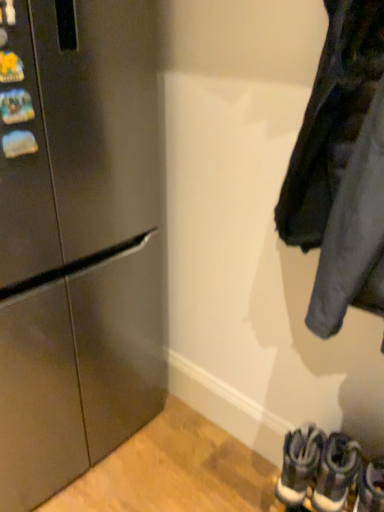
What is the approximate width of dark gray fabric jacket at right?

16.09 inches.

Identify the location of white leather sneakers at lower right, the first footwear in the right-to-left sequence. The image size is (384, 512). (371, 487).

From a real-world perspective, is dark gray suede sneakers at lower right, which is counted as the second footwear, starting from the left, physically located above or below dark gray fabric jacket at right?

Clearly, from a real-world perspective, dark gray suede sneakers at lower right, which is counted as the second footwear, starting from the left, is below dark gray fabric jacket at right.

Is dark gray suede sneakers at lower right, which is counted as the second footwear, starting from the left, outside of dark gray fabric jacket at right?

That's correct, dark gray suede sneakers at lower right, which is counted as the second footwear, starting from the left, is outside of dark gray fabric jacket at right.

Considering the points (319, 470) and (329, 105), which point is behind, point (319, 470) or point (329, 105)?

The point (319, 470) is farther.

Is dark gray fabric jacket at right far away from white leather sneakers at lower right, the first footwear positioned from the left?

No, dark gray fabric jacket at right is not far away from white leather sneakers at lower right, the first footwear positioned from the left.

Measure the distance between dark gray fabric jacket at right and white leather sneakers at lower right, positioned as the 3th footwear in right-to-left order.

dark gray fabric jacket at right is 26.94 inches away from white leather sneakers at lower right, positioned as the 3th footwear in right-to-left order.

What's the angular difference between dark gray fabric jacket at right and white leather sneakers at lower right, positioned as the 3th footwear in right-to-left order,'s facing directions?

7.63 degrees.

Between dark gray fabric jacket at right and white leather sneakers at lower right, positioned as the 3th footwear in right-to-left order, which one appears on the right side from the viewer's perspective?

Positioned to the right is dark gray fabric jacket at right.

Considering the positions of objects stainless steel refrigerator at left and white leather sneakers at lower right, the first footwear positioned from the left, in the image provided, who is more to the left, stainless steel refrigerator at left or white leather sneakers at lower right, the first footwear positioned from the left,?

stainless steel refrigerator at left is more to the left.

Is stainless steel refrigerator at left facing towards white leather sneakers at lower right, the first footwear positioned from the left?

Yes, stainless steel refrigerator at left faces towards white leather sneakers at lower right, the first footwear positioned from the left.

Can you confirm if stainless steel refrigerator at left is shorter than white leather sneakers at lower right, the first footwear positioned from the left?

No.

Is stainless steel refrigerator at left positioned beyond the bounds of white leather sneakers at lower right, positioned as the 3th footwear in right-to-left order?

Yes, stainless steel refrigerator at left is located beyond the bounds of white leather sneakers at lower right, positioned as the 3th footwear in right-to-left order.

Which object is positioned more to the left, white leather sneakers at lower right, the first footwear positioned from the left, or stainless steel refrigerator at left?

Positioned to the left is stainless steel refrigerator at left.

Is white leather sneakers at lower right, positioned as the 3th footwear in right-to-left order, smaller than stainless steel refrigerator at left?

Yes, white leather sneakers at lower right, positioned as the 3th footwear in right-to-left order, is smaller than stainless steel refrigerator at left.

Do you think white leather sneakers at lower right, positioned as the 3th footwear in right-to-left order, is within stainless steel refrigerator at left, or outside of it?

white leather sneakers at lower right, positioned as the 3th footwear in right-to-left order, is not enclosed by stainless steel refrigerator at left.

Measure the distance from white leather sneakers at lower right, the first footwear positioned from the left, to stainless steel refrigerator at left.

white leather sneakers at lower right, the first footwear positioned from the left, and stainless steel refrigerator at left are 83.42 centimeters apart.

How different are the orientations of dark gray suede sneakers at lower right, which is counted as the second footwear, starting from the left, and stainless steel refrigerator at left in degrees?

The angle between the facing direction of dark gray suede sneakers at lower right, which is counted as the second footwear, starting from the left, and the facing direction of stainless steel refrigerator at left is 81.1 degrees.

Considering the sizes of dark gray suede sneakers at lower right, which is counted as the second footwear, starting from the left, and stainless steel refrigerator at left in the image, is dark gray suede sneakers at lower right, which is counted as the second footwear, starting from the left, wider or thinner than stainless steel refrigerator at left?

Clearly, dark gray suede sneakers at lower right, which is counted as the second footwear, starting from the left, has less width compared to stainless steel refrigerator at left.

Do you think dark gray suede sneakers at lower right, the 2th footwear from the right, is within stainless steel refrigerator at left, or outside of it?

dark gray suede sneakers at lower right, the 2th footwear from the right, is not inside stainless steel refrigerator at left, it's outside.

From a real-world perspective, who is located higher, dark gray suede sneakers at lower right, which is counted as the second footwear, starting from the left, or stainless steel refrigerator at left?

stainless steel refrigerator at left is physically above.

Considering the relative sizes of dark gray suede sneakers at lower right, which is counted as the second footwear, starting from the left, and white leather sneakers at lower right, arranged as the 3th footwear when viewed from the left, in the image provided, is dark gray suede sneakers at lower right, which is counted as the second footwear, starting from the left, wider than white leather sneakers at lower right, arranged as the 3th footwear when viewed from the left,?

No, dark gray suede sneakers at lower right, which is counted as the second footwear, starting from the left, is not wider than white leather sneakers at lower right, arranged as the 3th footwear when viewed from the left.

Between dark gray suede sneakers at lower right, the 2th footwear from the right, and white leather sneakers at lower right, the first footwear in the right-to-left sequence, which one has smaller size?

white leather sneakers at lower right, the first footwear in the right-to-left sequence.

Which object is positioned more to the left, dark gray suede sneakers at lower right, which is counted as the second footwear, starting from the left, or white leather sneakers at lower right, arranged as the 3th footwear when viewed from the left?

dark gray suede sneakers at lower right, which is counted as the second footwear, starting from the left.

How distant is dark gray suede sneakers at lower right, which is counted as the second footwear, starting from the left, from white leather sneakers at lower right, the first footwear positioned from the left?

They are 2.35 inches apart.

Is dark gray suede sneakers at lower right, the 2th footwear from the right, spatially inside white leather sneakers at lower right, positioned as the 3th footwear in right-to-left order, or outside of it?

dark gray suede sneakers at lower right, the 2th footwear from the right, cannot be found inside white leather sneakers at lower right, positioned as the 3th footwear in right-to-left order.

What's the angular difference between dark gray suede sneakers at lower right, which is counted as the second footwear, starting from the left, and white leather sneakers at lower right, positioned as the 3th footwear in right-to-left order,'s facing directions?

The angular difference between dark gray suede sneakers at lower right, which is counted as the second footwear, starting from the left, and white leather sneakers at lower right, positioned as the 3th footwear in right-to-left order, is 3.44e-05 degrees.

Can you confirm if dark gray suede sneakers at lower right, the 2th footwear from the right, is smaller than white leather sneakers at lower right, the first footwear positioned from the left?

Indeed, dark gray suede sneakers at lower right, the 2th footwear from the right, has a smaller size compared to white leather sneakers at lower right, the first footwear positioned from the left.

Where is `the 3rd footwear located beneath the dark gray fabric jacket at right (from a real-world perspective)`? The height and width of the screenshot is (512, 384). the 3rd footwear located beneath the dark gray fabric jacket at right (from a real-world perspective) is located at coordinates (336, 472).

In order to click on footwear on the left of dark gray fabric jacket at right in this screenshot , I will do `click(299, 464)`.

Looking at the image, which one is located closer to dark gray suede sneakers at lower right, the 2th footwear from the right, white leather sneakers at lower right, arranged as the 3th footwear when viewed from the left, or dark gray fabric jacket at right?

Among the two, white leather sneakers at lower right, arranged as the 3th footwear when viewed from the left, is located nearer to dark gray suede sneakers at lower right, the 2th footwear from the right.

When comparing their distances from dark gray fabric jacket at right, does stainless steel refrigerator at left or white leather sneakers at lower right, positioned as the 3th footwear in right-to-left order, seem closer?

The object closer to dark gray fabric jacket at right is white leather sneakers at lower right, positioned as the 3th footwear in right-to-left order.

Based on the photo, from the image, which object appears to be nearer to stainless steel refrigerator at left, dark gray suede sneakers at lower right, the 2th footwear from the right, or white leather sneakers at lower right, the first footwear in the right-to-left sequence?

Based on the image, dark gray suede sneakers at lower right, the 2th footwear from the right, appears to be nearer to stainless steel refrigerator at left.

Estimate the real-world distances between objects in this image. Which object is closer to white leather sneakers at lower right, the first footwear positioned from the left, white leather sneakers at lower right, arranged as the 3th footwear when viewed from the left, or dark gray fabric jacket at right?

white leather sneakers at lower right, arranged as the 3th footwear when viewed from the left.

When comparing their distances from stainless steel refrigerator at left, does dark gray fabric jacket at right or white leather sneakers at lower right, positioned as the 3th footwear in right-to-left order, seem closer?

The object closer to stainless steel refrigerator at left is dark gray fabric jacket at right.

From the image, which object appears to be farther from white leather sneakers at lower right, the first footwear in the right-to-left sequence, dark gray suede sneakers at lower right, which is counted as the second footwear, starting from the left, or stainless steel refrigerator at left?

stainless steel refrigerator at left is positioned further to the anchor white leather sneakers at lower right, the first footwear in the right-to-left sequence.

When comparing their distances from dark gray fabric jacket at right, does dark gray suede sneakers at lower right, which is counted as the second footwear, starting from the left, or white leather sneakers at lower right, positioned as the 3th footwear in right-to-left order, seem further?

dark gray suede sneakers at lower right, which is counted as the second footwear, starting from the left, is positioned further to the anchor dark gray fabric jacket at right.

When comparing their distances from dark gray fabric jacket at right, does white leather sneakers at lower right, arranged as the 3th footwear when viewed from the left, or stainless steel refrigerator at left seem closer?

stainless steel refrigerator at left is positioned closer to the anchor dark gray fabric jacket at right.

Image resolution: width=384 pixels, height=512 pixels. Identify the location of jacket between stainless steel refrigerator at left and dark gray suede sneakers at lower right, the 2th footwear from the right, in the horizontal direction. (341, 169).

The image size is (384, 512). In order to click on jacket situated between stainless steel refrigerator at left and white leather sneakers at lower right, arranged as the 3th footwear when viewed from the left, from left to right in this screenshot , I will do `click(341, 169)`.

Where is `footwear between white leather sneakers at lower right, the first footwear positioned from the left, and white leather sneakers at lower right, arranged as the 3th footwear when viewed from the left, from left to right`? This screenshot has height=512, width=384. footwear between white leather sneakers at lower right, the first footwear positioned from the left, and white leather sneakers at lower right, arranged as the 3th footwear when viewed from the left, from left to right is located at coordinates tap(336, 472).

This screenshot has height=512, width=384. Identify the location of footwear situated between stainless steel refrigerator at left and dark gray fabric jacket at right from left to right. (299, 464).